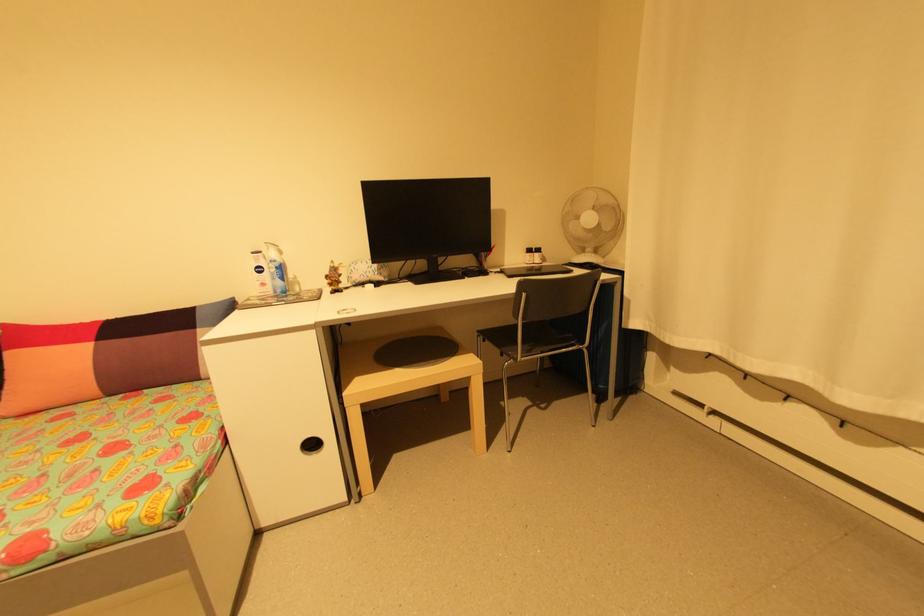
In order to click on long colorful pillow in this screenshot , I will do `click(103, 357)`.